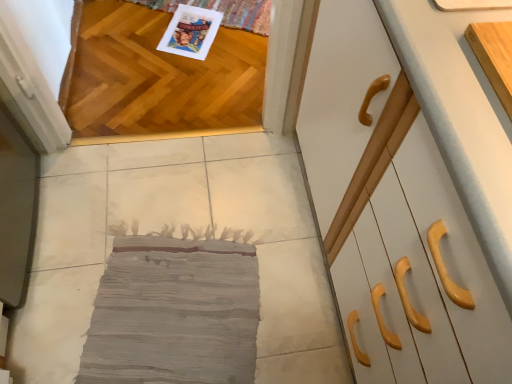
Question: Is gray fabric rug at center looking in the opposite direction of light wood cutting board at upper right, the first cabinetry positioned from the back?

Choices:
 (A) yes
 (B) no

Answer: (B)

Question: Does gray fabric rug at center turn towards light wood cutting board at upper right, the first cabinetry positioned from the back?

Choices:
 (A) no
 (B) yes

Answer: (A)

Question: Is gray fabric rug at center shorter than light wood cutting board at upper right, the first cabinetry positioned from the back?

Choices:
 (A) yes
 (B) no

Answer: (A)

Question: From the image's perspective, is gray fabric rug at center located beneath light wood cutting board at upper right, the first cabinetry positioned from the back?

Choices:
 (A) yes
 (B) no

Answer: (A)

Question: Would you say gray fabric rug at center is outside light wood cutting board at upper right, arranged as the 2th cabinetry when viewed from the front?

Choices:
 (A) yes
 (B) no

Answer: (A)

Question: Is gray fabric rug at center taller than light wood cutting board at upper right, arranged as the 2th cabinetry when viewed from the front?

Choices:
 (A) yes
 (B) no

Answer: (B)

Question: Is shiny oak hardwood at upper left bigger than white glossy cabinet at right, the first cabinetry when ordered from front to back?

Choices:
 (A) no
 (B) yes

Answer: (A)

Question: Can you confirm if shiny oak hardwood at upper left is smaller than white glossy cabinet at right, the first cabinetry when ordered from front to back?

Choices:
 (A) yes
 (B) no

Answer: (A)

Question: Does shiny oak hardwood at upper left lie behind white glossy cabinet at right, the first cabinetry when ordered from front to back?

Choices:
 (A) no
 (B) yes

Answer: (B)

Question: From the image's perspective, is shiny oak hardwood at upper left on top of white glossy cabinet at right, the first cabinetry when ordered from front to back?

Choices:
 (A) yes
 (B) no

Answer: (A)

Question: Is shiny oak hardwood at upper left placed right next to white glossy cabinet at right, the first cabinetry when ordered from front to back?

Choices:
 (A) no
 (B) yes

Answer: (A)

Question: Can white glossy cabinet at right, the first cabinetry when ordered from front to back, be found inside shiny oak hardwood at upper left?

Choices:
 (A) yes
 (B) no

Answer: (B)

Question: Considering the relative sizes of light wood cutting board at upper right, arranged as the 2th cabinetry when viewed from the front, and shiny oak hardwood at upper left in the image provided, is light wood cutting board at upper right, arranged as the 2th cabinetry when viewed from the front, taller than shiny oak hardwood at upper left?

Choices:
 (A) yes
 (B) no

Answer: (B)